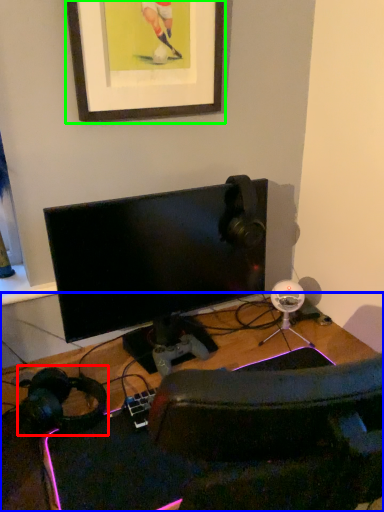
Question: Considering the real-world distances, which object is farthest from headphones (highlighted by a red box)? desk (highlighted by a blue box) or picture frame (highlighted by a green box)?

Choices:
 (A) desk
 (B) picture frame

Answer: (B)